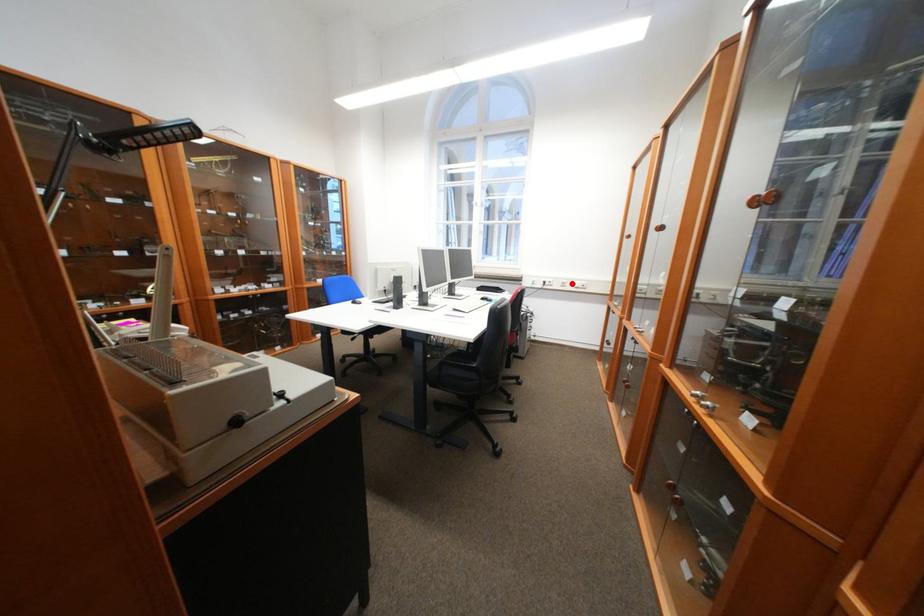
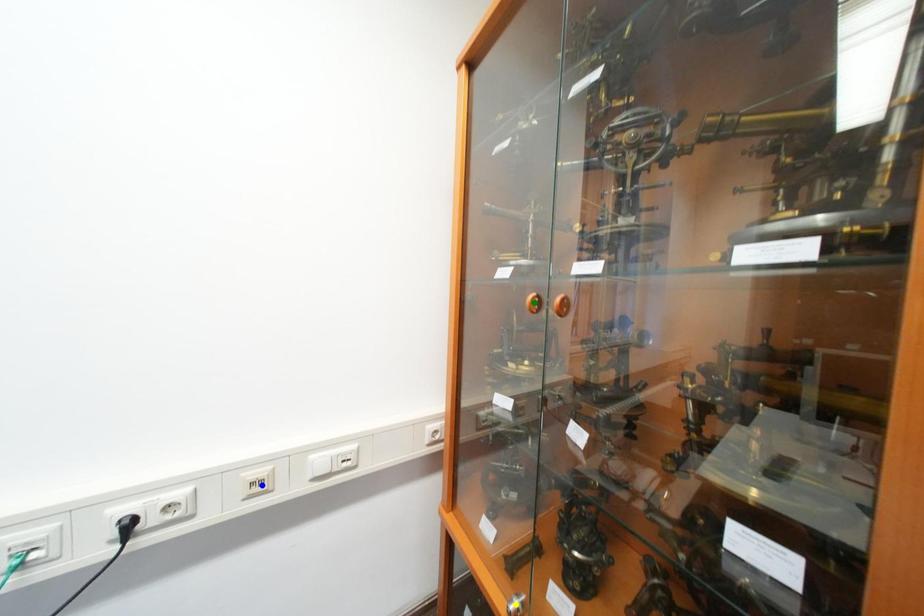
Question: I am providing you with two images of the same scene from different viewpoints. A red point is marked on the first image. You are given multiple points on the second image. Can you choose the point in image 2 that corresponds to the point in image 1?

Choices:
 (A) yellow point
 (B) blue point
 (C) green point

Answer: (B)